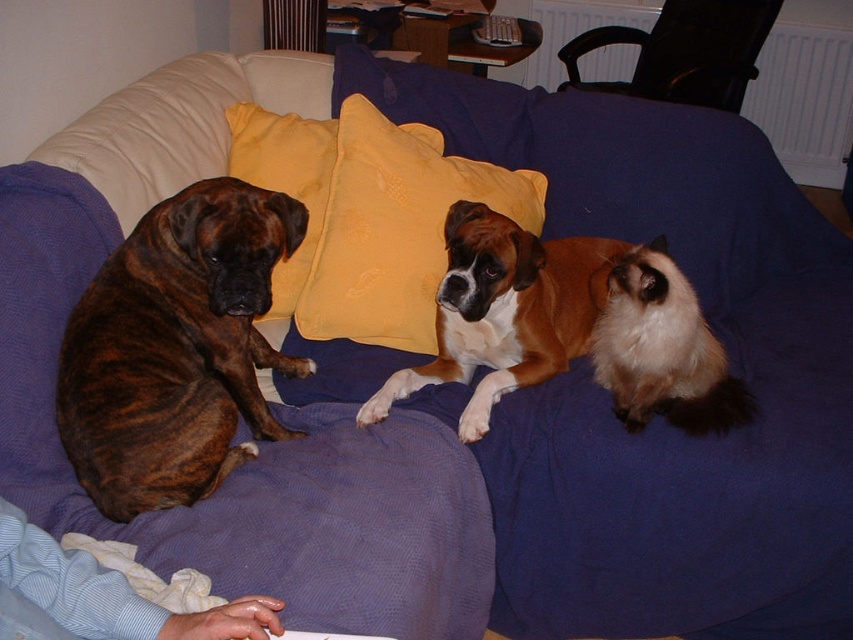
Question: Observing the image, what is the correct spatial positioning of brindle fur dog at left in reference to yellow fabric pillow at center?

Choices:
 (A) right
 (B) left

Answer: (B)

Question: Observing the image, what is the correct spatial positioning of brown shiny fur dog at center in reference to yellow fabric pillow at upper center?

Choices:
 (A) right
 (B) left

Answer: (A)

Question: Is brindle fur dog at left above yellow fabric pillow at upper center?

Choices:
 (A) no
 (B) yes

Answer: (A)

Question: Which point is closer to the camera?

Choices:
 (A) brindle fur dog at left
 (B) brown shiny fur dog at center
 (C) yellow fabric pillow at center
 (D) black plastic chair at upper right

Answer: (A)

Question: Among these objects, which one is farthest from the camera?

Choices:
 (A) brindle fur dog at left
 (B) black plastic chair at upper right
 (C) brown shiny fur dog at center
 (D) yellow fabric pillow at upper center

Answer: (B)

Question: Which point is closer to the camera?

Choices:
 (A) yellow fabric pillow at center
 (B) black plastic chair at upper right
 (C) brown shiny fur dog at center

Answer: (C)